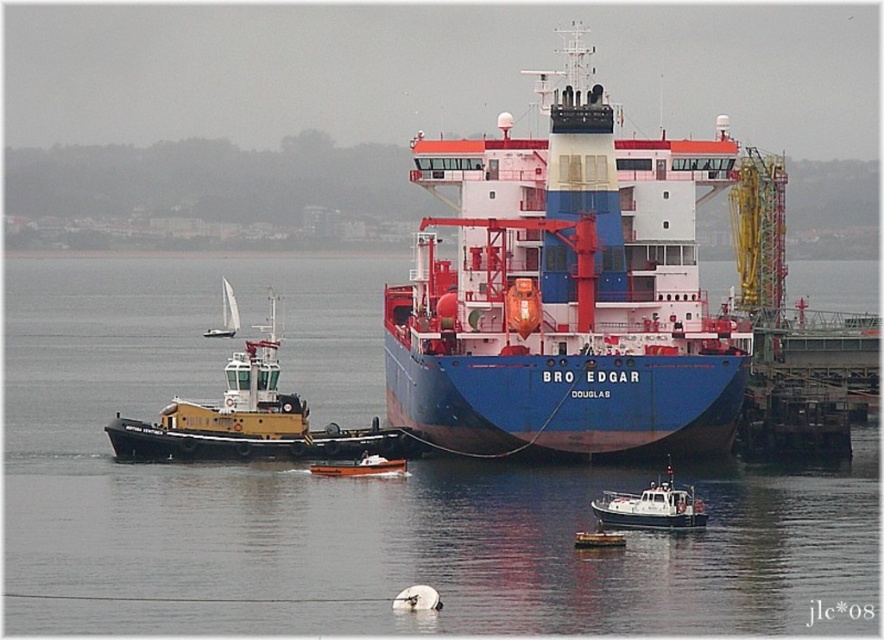
Is blue matte cargo ship at center positioned behind white sailboat at upper left?

No.

Between point (494, 241) and point (235, 330), which one is positioned in front?

Point (494, 241) is more forward.

The height and width of the screenshot is (640, 884). I want to click on blue matte cargo ship at center, so click(x=565, y=291).

Can you confirm if blue matte cargo ship at center is positioned to the right of yellow matte tugboat at left?

Indeed, blue matte cargo ship at center is positioned on the right side of yellow matte tugboat at left.

Is point (546, 316) positioned behind point (413, 452)?

Yes, point (546, 316) is behind point (413, 452).

At what (x,y) coordinates should I click in order to perform the action: click on blue matte cargo ship at center. Please return your answer as a coordinate pair (x, y). Looking at the image, I should click on (565, 291).

Looking at this image, can you confirm if blue matte water at center is positioned to the right of white sailboat at upper left?

Correct, you'll find blue matte water at center to the right of white sailboat at upper left.

Who is taller, blue matte water at center or white sailboat at upper left?

Standing taller between the two is blue matte water at center.

Is point (27, 376) farther from camera compared to point (225, 285)?

No, it is not.

You are a GUI agent. You are given a task and a screenshot of the screen. Output one action in this format:
    pyautogui.click(x=<x>, y=<y>)
    Task: Click on the blue matte water at center
    This screenshot has width=884, height=640.
    Given the screenshot: What is the action you would take?
    [x=357, y=486]